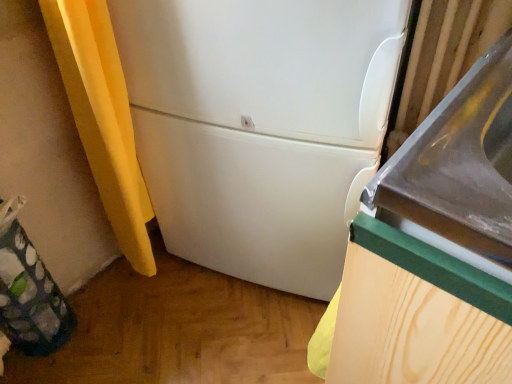
Measure the distance between green fabric bag at lower left and camera.

They are 34.53 inches apart.

The height and width of the screenshot is (384, 512). What are the coordinates of `white matte refrigerator at center` in the screenshot? It's located at (260, 126).

This screenshot has width=512, height=384. Find the location of `white glossy sink at center right`. white glossy sink at center right is located at coordinates (460, 163).

From a real-world perspective, is white glossy sink at center right over white matte refrigerator at center?

Incorrect, from a real-world perspective, white glossy sink at center right is lower than white matte refrigerator at center.

Can you tell me how much white glossy sink at center right and white matte refrigerator at center differ in facing direction?

They differ by 19.5 degrees in their facing directions.

Locate an element on the screen. Image resolution: width=512 pixels, height=384 pixels. sink that is below the white matte refrigerator at center (from the image's perspective) is located at coordinates (460, 163).

Is white glossy sink at center right turned away from white matte refrigerator at center?

white glossy sink at center right is not turned away from white matte refrigerator at center.

Is green fabric bag at lower left beside white glossy sink at center right?

No.

Considering the relative sizes of green fabric bag at lower left and white glossy sink at center right in the image provided, is green fabric bag at lower left bigger than white glossy sink at center right?

No.

From the image's perspective, is green fabric bag at lower left located above or below white glossy sink at center right?

green fabric bag at lower left is below white glossy sink at center right.

From a real-world perspective, is green fabric bag at lower left located beneath white glossy sink at center right?

Yes, from a real-world perspective, green fabric bag at lower left is beneath white glossy sink at center right.

From a real-world perspective, who is located higher, white matte refrigerator at center or green fabric bag at lower left?

In real-world perspective, white matte refrigerator at center is above.

Between white matte refrigerator at center and green fabric bag at lower left, which one has larger width?

Wider between the two is white matte refrigerator at center.

Is point (342, 144) in front of point (49, 314)?

That is True.

Would you consider white matte refrigerator at center to be distant from green fabric bag at lower left?

Actually, white matte refrigerator at center and green fabric bag at lower left are a little close together.

Is white matte refrigerator at center oriented away from white glossy sink at center right?

No, white matte refrigerator at center's orientation is not away from white glossy sink at center right.

Do you think white matte refrigerator at center is within white glossy sink at center right, or outside of it?

white matte refrigerator at center lies outside white glossy sink at center right.

Locate an element on the screen. The height and width of the screenshot is (384, 512). sink below the white matte refrigerator at center (from the image's perspective) is located at coordinates (460, 163).

Which is in front, point (189, 53) or point (376, 199)?

The point (376, 199) is closer.

Between green fabric bag at lower left and white matte refrigerator at center, which one appears on the left side from the viewer's perspective?

green fabric bag at lower left is more to the left.

From the image's perspective, which is below, green fabric bag at lower left or white matte refrigerator at center?

green fabric bag at lower left is shown below in the image.

Considering their positions, is green fabric bag at lower left located in front of or behind white matte refrigerator at center?

In the image, green fabric bag at lower left appears behind white matte refrigerator at center.

Is white glossy sink at center right directly adjacent to green fabric bag at lower left?

No, white glossy sink at center right is not beside green fabric bag at lower left.

Which is in front, white glossy sink at center right or green fabric bag at lower left?

white glossy sink at center right.

Which of these two, white glossy sink at center right or green fabric bag at lower left, stands taller?

Standing taller between the two is white glossy sink at center right.

At what (x,y) coordinates should I click in order to perform the action: click on refrigerator on the left of white glossy sink at center right. Please return your answer as a coordinate pair (x, y). Looking at the image, I should click on (260, 126).

At what (x,y) coordinates should I click in order to perform the action: click on sink lying above the green fabric bag at lower left (from the image's perspective). Please return your answer as a coordinate pair (x, y). Looking at the image, I should click on (460, 163).

Considering their positions, is white matte refrigerator at center positioned closer to white glossy sink at center right than green fabric bag at lower left?

white matte refrigerator at center lies closer to white glossy sink at center right than the other object.

Considering their positions, is white glossy sink at center right positioned further to green fabric bag at lower left than white matte refrigerator at center?

The object further to green fabric bag at lower left is white glossy sink at center right.

Looking at this image, considering their positions, is green fabric bag at lower left positioned closer to white matte refrigerator at center than white glossy sink at center right?

white glossy sink at center right lies closer to white matte refrigerator at center than the other object.

Considering their positions, is white matte refrigerator at center positioned closer to green fabric bag at lower left than white glossy sink at center right?

Based on the image, white matte refrigerator at center appears to be nearer to green fabric bag at lower left.

Based on their spatial positions, is green fabric bag at lower left or white matte refrigerator at center closer to white glossy sink at center right?

white matte refrigerator at center is positioned closer to the anchor white glossy sink at center right.

Looking at the image, which one is located closer to white matte refrigerator at center, white glossy sink at center right or green fabric bag at lower left?

Among the two, white glossy sink at center right is located nearer to white matte refrigerator at center.

I want to click on refrigerator between green fabric bag at lower left and white glossy sink at center right in the horizontal direction, so click(260, 126).